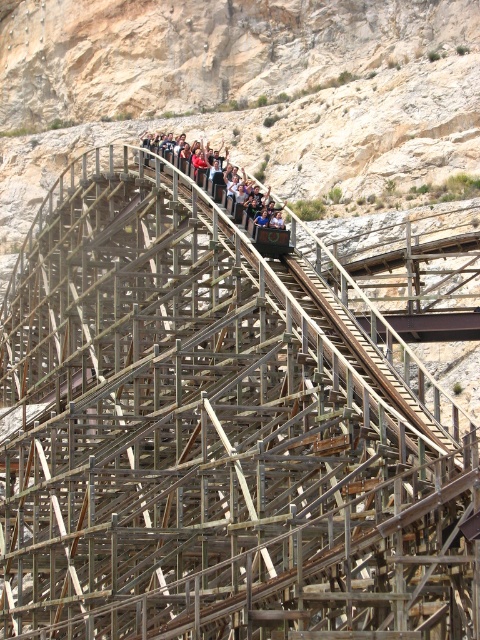
Question: Among these points, which one is farthest from the camera?

Choices:
 (A) click(x=397, y=0)
 (B) click(x=180, y=160)

Answer: (A)

Question: Where is wooden roller coaster at upper center located in relation to matte wooden roller coaster car at center in the image?

Choices:
 (A) above
 (B) below

Answer: (A)

Question: Can you confirm if wooden roller coaster at upper center is positioned to the right of matte wooden roller coaster car at center?

Choices:
 (A) no
 (B) yes

Answer: (A)

Question: Can you confirm if wooden roller coaster at upper center is positioned above matte wooden roller coaster car at center?

Choices:
 (A) yes
 (B) no

Answer: (A)